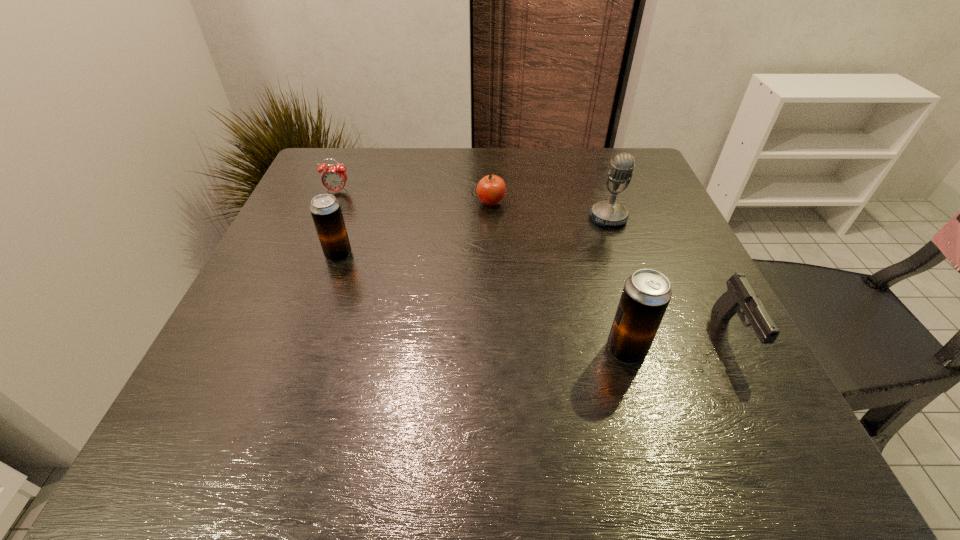
Identify the location of vacant space located 0.390m on the front-facing side of the microphone. The width and height of the screenshot is (960, 540). (664, 377).

Identify the location of vacant space located 0.150m on the back of the fourth object from right to left. This screenshot has height=540, width=960. (490, 164).

Locate an element on the screen. vacant space situated on the face of the alarm clock is located at coordinates (294, 296).

I want to click on vacant space situated 0.050m aim along the barrel of the pistol, so click(764, 396).

The image size is (960, 540). What are the coordinates of `apple that is at the far edge` in the screenshot? It's located at (491, 190).

At what (x,y) coordinates should I click in order to perform the action: click on alarm clock that is at the far edge. Please return your answer as a coordinate pair (x, y). Looking at the image, I should click on tap(333, 178).

Find the location of a particular element. The image size is (960, 540). beer can that is at the near edge is located at coordinates (646, 294).

Find the location of a particular element. The height and width of the screenshot is (540, 960). pistol that is positioned at the near edge is located at coordinates (740, 295).

Locate an element on the screen. Image resolution: width=960 pixels, height=540 pixels. beer can that is at the left edge is located at coordinates (326, 212).

The width and height of the screenshot is (960, 540). I want to click on alarm clock that is at the left edge, so click(x=333, y=178).